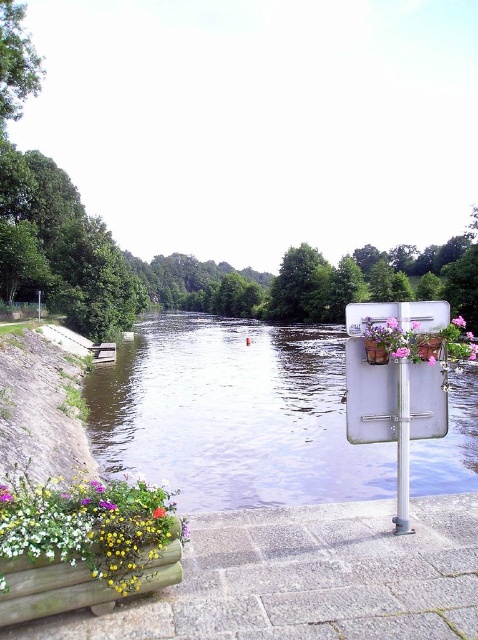
Question: Can you confirm if wooden planter at lower left is positioned to the left of pink matte flower pot at center-right?

Choices:
 (A) no
 (B) yes

Answer: (B)

Question: Which point appears farthest from the camera in this image?

Choices:
 (A) (54, 536)
 (B) (446, 634)
 (C) (405, 346)
 (D) (159, 509)

Answer: (C)

Question: Can you confirm if granite paving stones at lower center is positioned below pink floral bouquet at right?

Choices:
 (A) no
 (B) yes

Answer: (B)

Question: Which point is closer to the camera taking this photo?

Choices:
 (A) (205, 508)
 (B) (402, 364)
 (C) (406, 352)
 (D) (161, 515)

Answer: (D)

Question: Which object is closer to the camera taking this photo?

Choices:
 (A) white glossy pole at right
 (B) wooden planter at lower left
 (C) pink fabric flower at lower right

Answer: (B)

Question: Does wooden planter at lower left appear on the right side of pink floral bouquet at right?

Choices:
 (A) yes
 (B) no

Answer: (B)